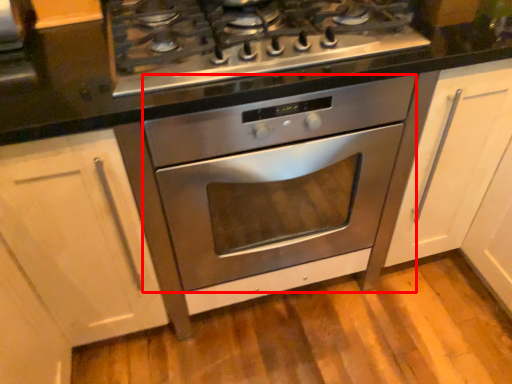
Question: From the image's perspective, where is oven (annotated by the red box) located relative to counter top?

Choices:
 (A) below
 (B) above

Answer: (A)